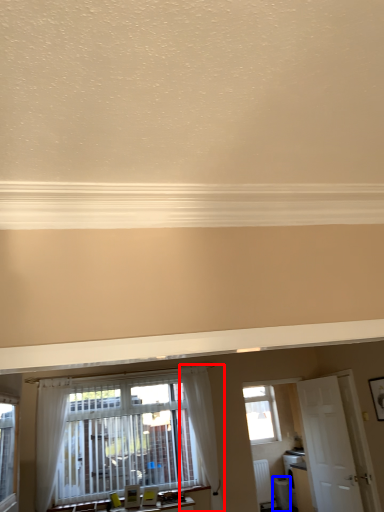
Question: Among these objects, which one is farthest to the camera, curtain (highlighted by a red box) or appliance (highlighted by a blue box)?

Choices:
 (A) curtain
 (B) appliance

Answer: (B)